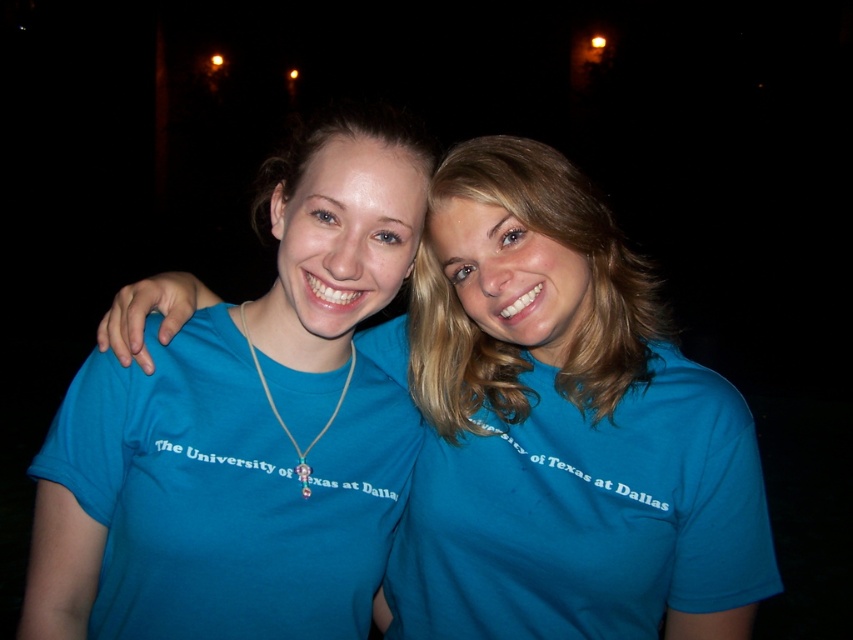
Question: Does matte blue t-shirt at center lie in front of gold chain with beads at center?

Choices:
 (A) no
 (B) yes

Answer: (B)

Question: Does blue cotton shirt at center have a smaller size compared to gold chain with beads at center?

Choices:
 (A) no
 (B) yes

Answer: (A)

Question: Estimate the real-world distances between objects in this image. Which object is farther from the blue cotton shirt at center?

Choices:
 (A) blue fabric shirt at center
 (B) matte blue t-shirt at center

Answer: (B)

Question: Does matte blue t-shirt at center appear on the left side of gold chain with beads at center?

Choices:
 (A) no
 (B) yes

Answer: (B)

Question: Which object is the farthest from the blue cotton shirt at center?

Choices:
 (A) matte blue t-shirt at center
 (B) gold chain with beads at center
 (C) blue fabric shirt at center

Answer: (B)

Question: Which of the following is the closest to the observer?

Choices:
 (A) (415, 204)
 (B) (297, 461)
 (C) (590, 276)
 (D) (625, 369)

Answer: (A)